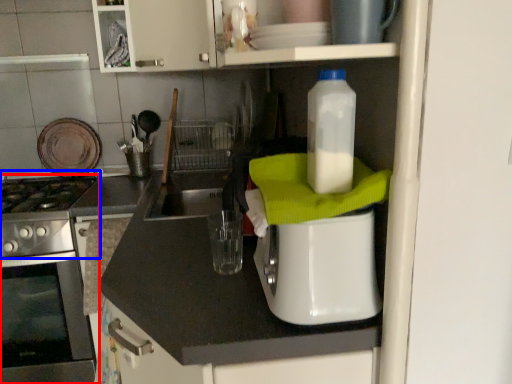
Question: Which of the following is the closest to the observer, home appliance (highlighted by a red box) or gas stove (highlighted by a blue box)?

Choices:
 (A) home appliance
 (B) gas stove

Answer: (B)